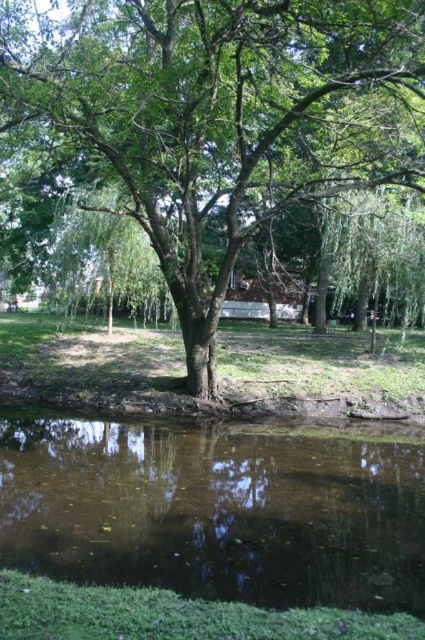
Consider the image. Does green leafy tree at center appear on the right side of brown murky water at bottom?

Indeed, green leafy tree at center is positioned on the right side of brown murky water at bottom.

Does green leafy tree at center have a greater width compared to brown murky water at bottom?

Indeed, green leafy tree at center has a greater width compared to brown murky water at bottom.

Who is more forward, (212,106) or (166,467)?

Point (166,467) is more forward.

Locate an element on the screen. Image resolution: width=425 pixels, height=640 pixels. green leafy tree at center is located at coordinates (224, 116).